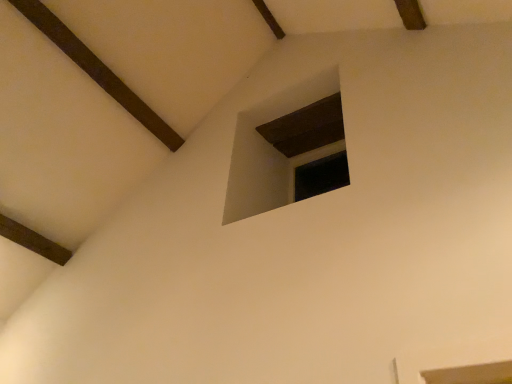
What are the coordinates of `dark wood window at upper center` in the screenshot? It's located at (267, 151).

This screenshot has height=384, width=512. What do you see at coordinates (267, 151) in the screenshot?
I see `dark wood window at upper center` at bounding box center [267, 151].

Measure the distance between dark wood window at upper center and camera.

dark wood window at upper center and camera are 7.42 feet apart.

Where is `dark wood window at upper center`? The height and width of the screenshot is (384, 512). dark wood window at upper center is located at coordinates point(267,151).